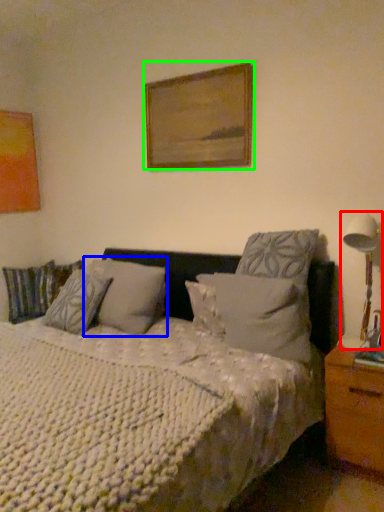
Question: Which is farther away from table lamp (highlighted by a red box)? pillow (highlighted by a blue box) or picture frame (highlighted by a green box)?

Choices:
 (A) pillow
 (B) picture frame

Answer: (A)